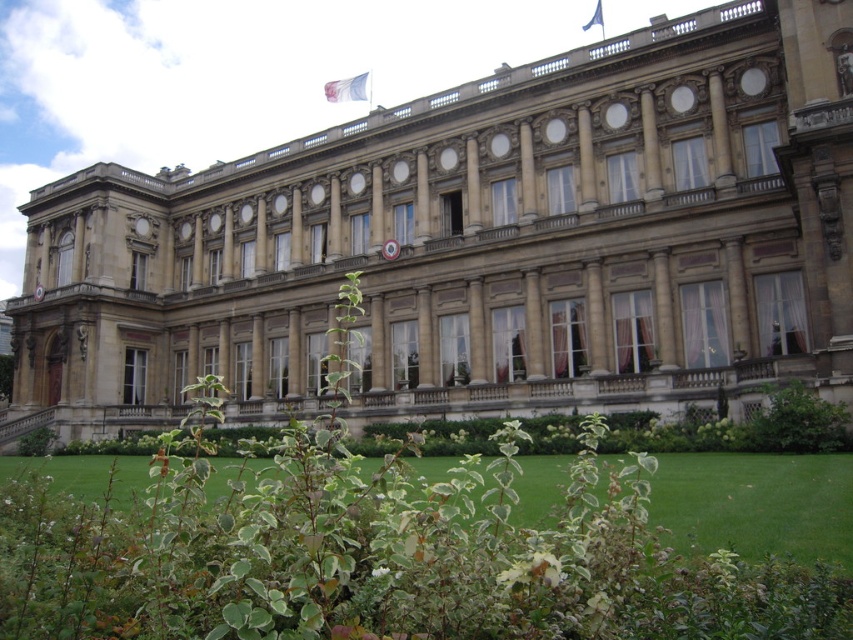
You are a gardener planning to mow the green grass at lower center and trim the green leafy bush at lower right. Which area requires more space for your equipment to maneuver?

The green grass at lower center might be wider than the green leafy bush at lower right, so the grass area likely requires more space for equipment maneuvering.